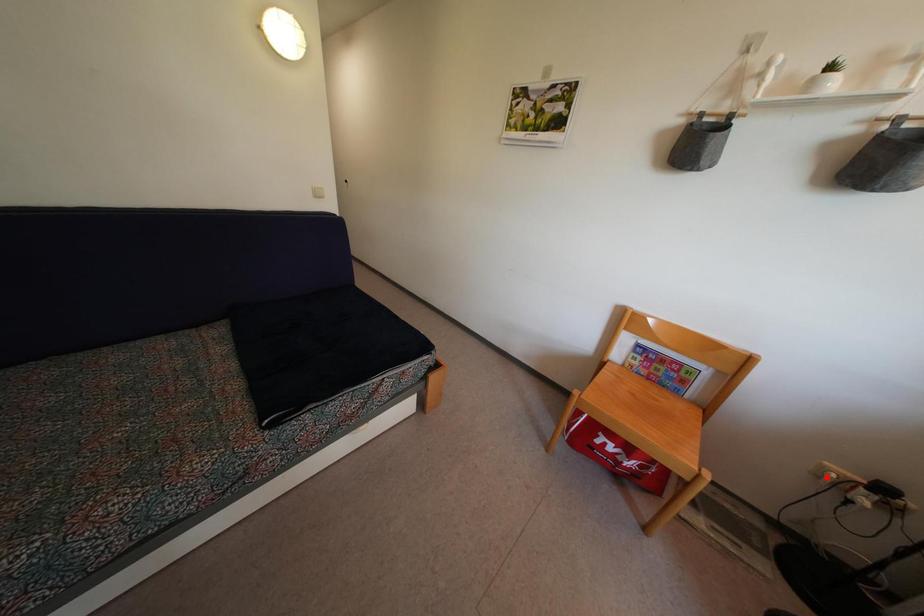
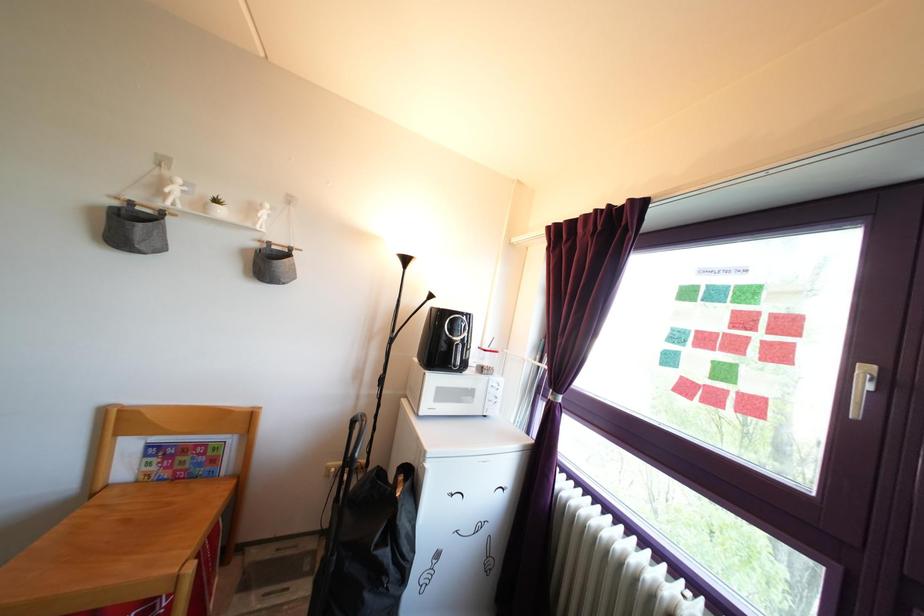
Question: I am providing you with two images of the same scene from different viewpoints. In image1, a red point is highlighted. Considering the same 3D point in image2, which of the following is correct?

Choices:
 (A) It is closer
 (B) It is farther

Answer: (B)